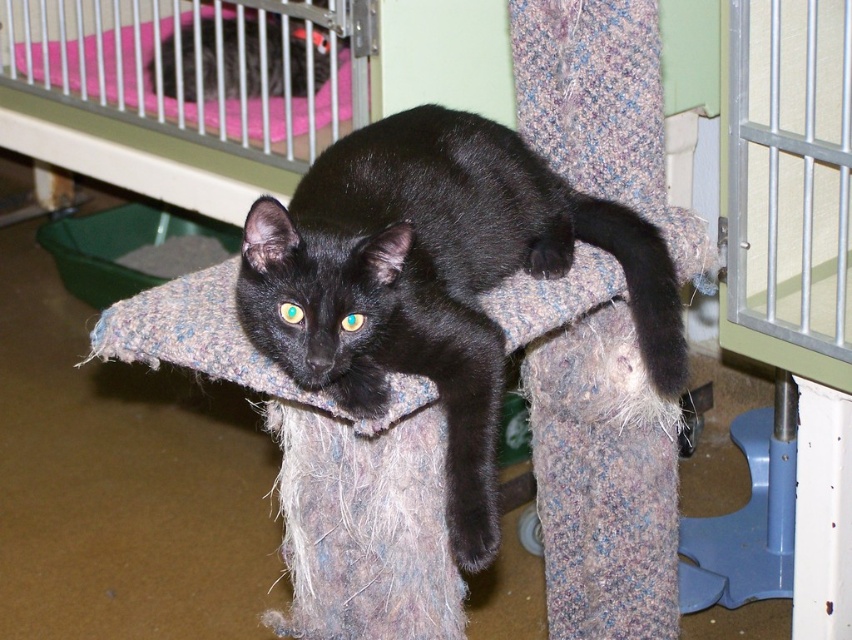
The width and height of the screenshot is (852, 640). What are the coordinates of `black fur cat at center` in the screenshot? It's located at (435, 280).

Which of these two, black fur cat at center or pink fabric infant bed at upper left, stands taller?

black fur cat at center is taller.

Measure the distance between point (488,493) and camera.

Point (488,493) and camera are 1.24 meters apart from each other.

Image resolution: width=852 pixels, height=640 pixels. What are the coordinates of `black fur cat at center` in the screenshot? It's located at point(435,280).

Does black fur cat at center have a greater height compared to black fur cat at upper left?

Indeed, black fur cat at center has a greater height compared to black fur cat at upper left.

Is black fur cat at center above black fur cat at upper left?

Incorrect, black fur cat at center is not positioned above black fur cat at upper left.

Is point (465, 148) less distant than point (170, 33)?

Yes, it is in front of point (170, 33).

Find the location of a particular element. black fur cat at center is located at coordinates (435, 280).

Is pink fabric infant bed at upper left bigger than black fur cat at upper left?

Yes.

How much distance is there between pink fabric infant bed at upper left and black fur cat at upper left?

pink fabric infant bed at upper left and black fur cat at upper left are 9.69 centimeters apart.

You are a GUI agent. You are given a task and a screenshot of the screen. Output one action in this format:
    pyautogui.click(x=<x>, y=<y>)
    Task: Click on the pink fabric infant bed at upper left
    
    Given the screenshot: What is the action you would take?
    pyautogui.click(x=128, y=67)